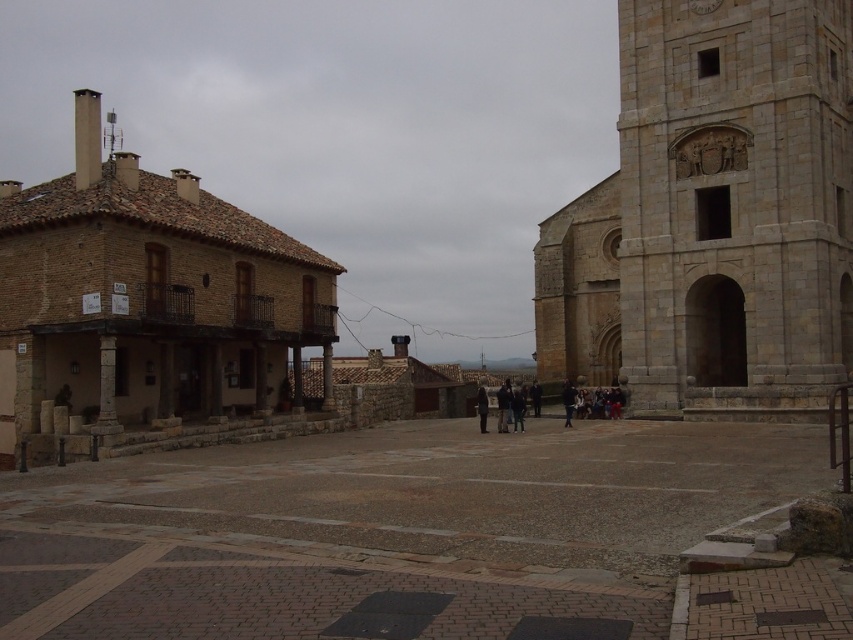
Question: Does smooth stone pavement at center appear on the left side of stone tower at right?

Choices:
 (A) yes
 (B) no

Answer: (A)

Question: Considering the real-world distances, which object is farthest from the dark blue jacket at center?

Choices:
 (A) stone tower at right
 (B) gold textured clock at upper right
 (C) brown brick church at left
 (D) smooth stone pavement at center

Answer: (B)

Question: Is dark blue jacket at center below gold textured clock at upper right?

Choices:
 (A) no
 (B) yes

Answer: (B)

Question: Which object is the closest to the gold textured clock at upper right?

Choices:
 (A) dark blue jacket at center
 (B) stone tower at right
 (C) brown brick church at left
 (D) dark gray coat at center

Answer: (B)

Question: Is brown brick church at left to the left of dark gray coat at center from the viewer's perspective?

Choices:
 (A) no
 (B) yes

Answer: (B)

Question: Which object is farther from the camera taking this photo?

Choices:
 (A) dark blue jacket at center
 (B) smooth stone pavement at center
 (C) gold textured clock at upper right
 (D) dark gray coat at center

Answer: (C)